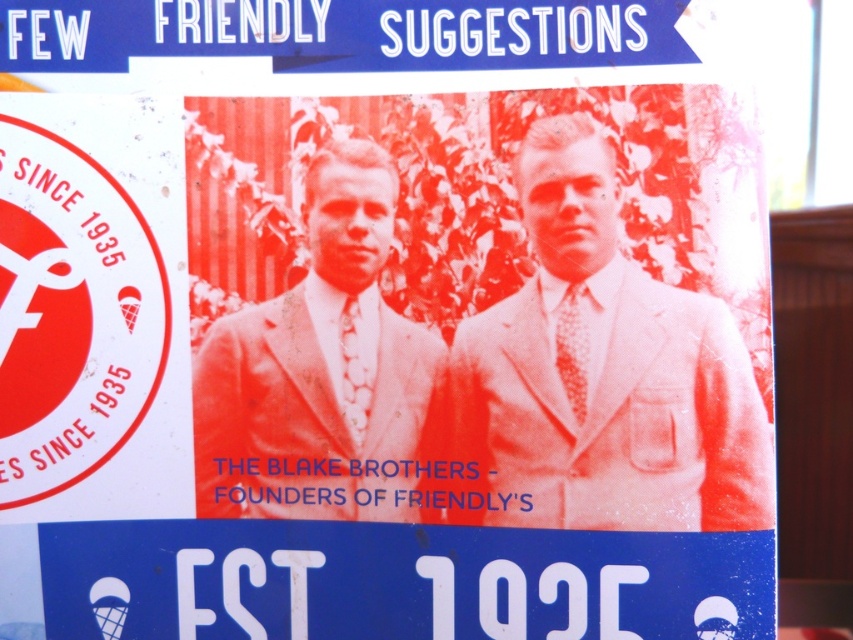
Question: Which point is closer to the camera taking this photo?

Choices:
 (A) (393, 333)
 (B) (550, 157)

Answer: (B)

Question: Does white textured suit at center appear over white suit at center?

Choices:
 (A) yes
 (B) no

Answer: (B)

Question: Does white textured suit at center lie in front of white suit at center?

Choices:
 (A) no
 (B) yes

Answer: (B)

Question: Does white textured suit at center appear on the left side of white suit at center?

Choices:
 (A) yes
 (B) no

Answer: (B)